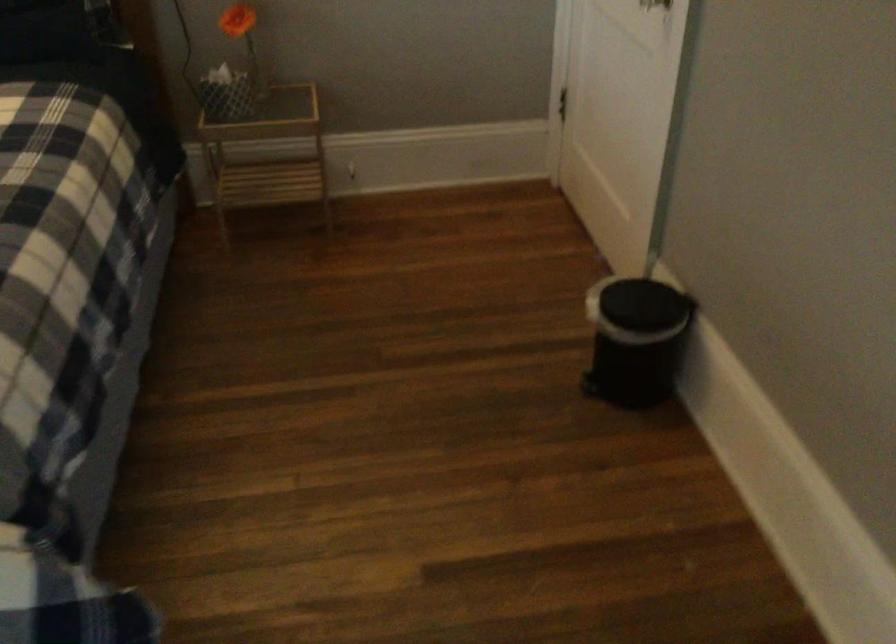
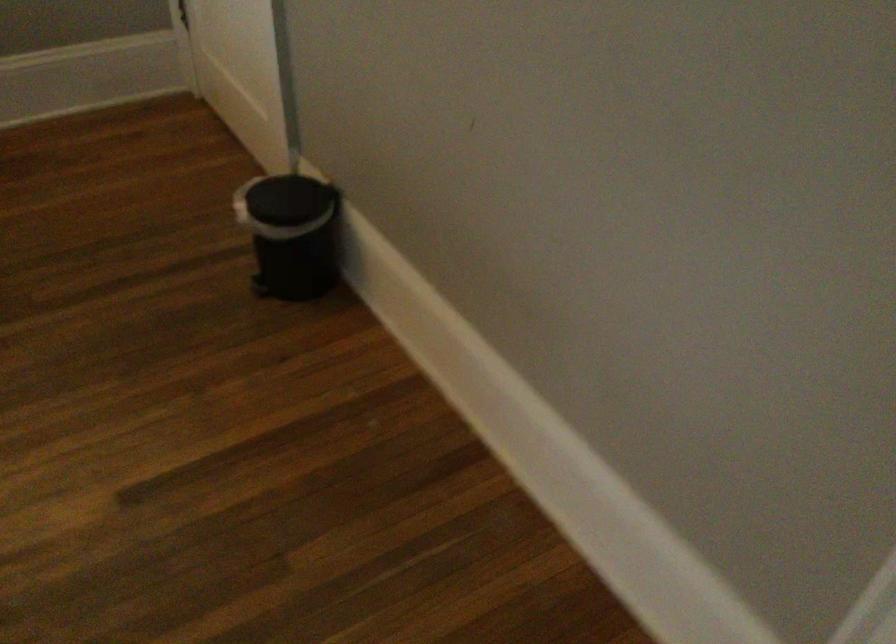
In a continuous first-person perspective shot, in which direction is the camera moving?

The cameraman walked toward right, backward.